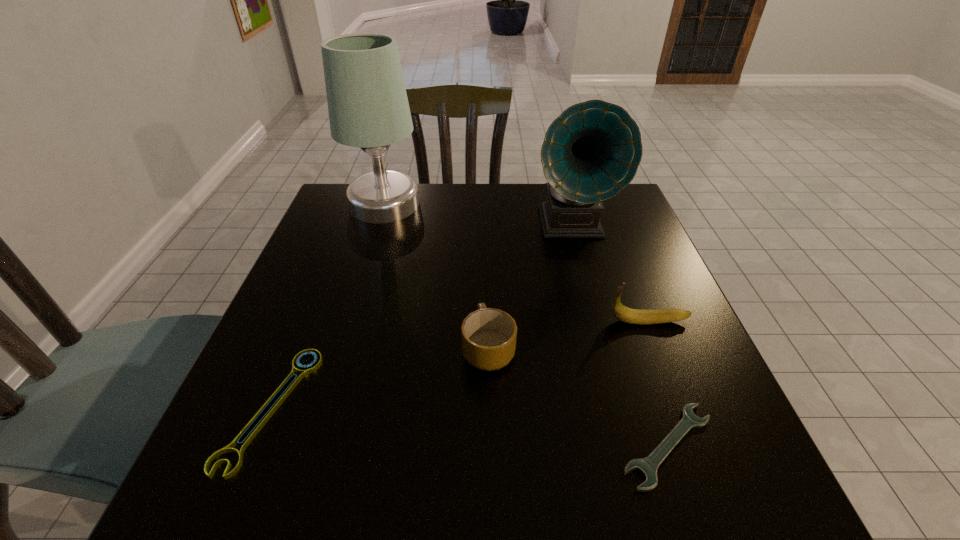
Find the location of `wrench that is at the left edge`. wrench that is at the left edge is located at coordinates (292, 379).

Locate an element on the screen. phonograph_record that is at the right edge is located at coordinates (x=591, y=151).

The image size is (960, 540). Identify the location of banana that is positioned at the right edge. coord(633,316).

Identify the location of wrench present at the right edge. (648, 466).

Identify the location of object that is at the far left corner. (368, 107).

Find the location of a particular element. Image resolution: width=960 pixels, height=540 pixels. object positioned at the near left corner is located at coordinates (292, 379).

Find the location of `object that is at the far right corner`. object that is at the far right corner is located at coordinates (591, 151).

At what (x,y) coordinates should I click in order to perform the action: click on object present at the near right corner. Please return your answer as a coordinate pair (x, y). Looking at the image, I should click on (648, 466).

The image size is (960, 540). I want to click on vacant point at the far edge, so click(x=427, y=219).

Where is `free space at the near edge of the desktop`? free space at the near edge of the desktop is located at coordinates (643, 494).